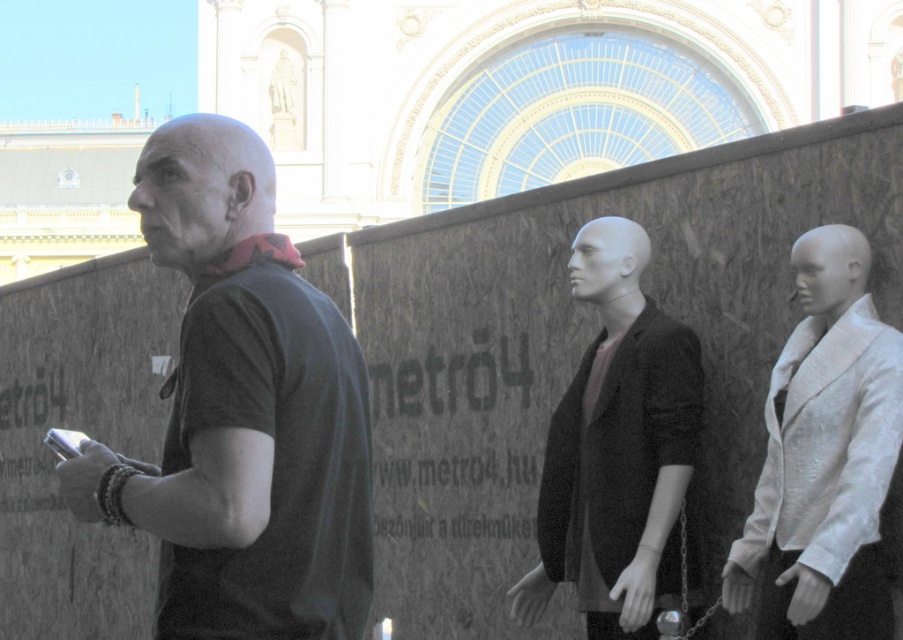
You are a delivery robot navigating an urban area. You need to deliver a package to the white silk jacket at right. The delivery zone is a circle with a radius of 0.1 centered at point (824,458). Can you confirm if the white silk jacket at right is within the delivery zone?

The white silk jacket at right is located at point (824,458), which is the center of the delivery zone. Therefore, it is within the delivery zone.